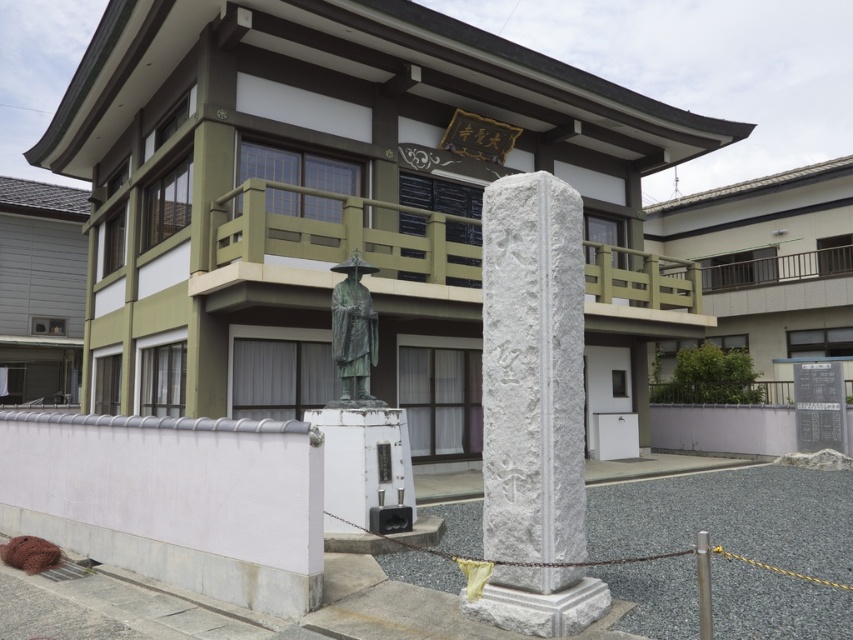
You are a visitor at this Japanese architectural site. You see the white stone pillar at center and the bronze statue at center. Which object is located above the other?

The bronze statue at center is above the white stone pillar at center because the white stone pillar at center is positioned under bronze statue at center.